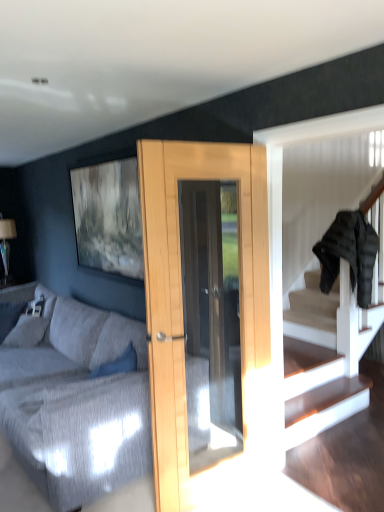
Question: Is black puffer jacket at upper right at the back of textured gray fabric couch at center?

Choices:
 (A) no
 (B) yes

Answer: (A)

Question: Does textured gray fabric couch at center have a greater height compared to black puffer jacket at upper right?

Choices:
 (A) yes
 (B) no

Answer: (B)

Question: Is textured gray fabric couch at center thinner than black puffer jacket at upper right?

Choices:
 (A) yes
 (B) no

Answer: (B)

Question: Is textured gray fabric couch at center positioned beyond the bounds of black puffer jacket at upper right?

Choices:
 (A) no
 (B) yes

Answer: (B)

Question: From a real-world perspective, is textured gray fabric couch at center below black puffer jacket at upper right?

Choices:
 (A) no
 (B) yes

Answer: (B)

Question: From the image's perspective, is textured gray fabric couch at center below black puffer jacket at upper right?

Choices:
 (A) no
 (B) yes

Answer: (B)

Question: Does black puffer jacket at upper right have a smaller size compared to textured gray fabric couch at center?

Choices:
 (A) yes
 (B) no

Answer: (A)

Question: Can you confirm if black puffer jacket at upper right is bigger than textured gray fabric couch at center?

Choices:
 (A) no
 (B) yes

Answer: (A)

Question: Can you confirm if black puffer jacket at upper right is taller than textured gray fabric couch at center?

Choices:
 (A) no
 (B) yes

Answer: (B)

Question: Can you confirm if black puffer jacket at upper right is shorter than textured gray fabric couch at center?

Choices:
 (A) yes
 (B) no

Answer: (B)

Question: Considering the relative positions of black puffer jacket at upper right and textured gray fabric couch at center in the image provided, is black puffer jacket at upper right behind textured gray fabric couch at center?

Choices:
 (A) yes
 (B) no

Answer: (A)

Question: Is black puffer jacket at upper right looking in the opposite direction of textured gray fabric couch at center?

Choices:
 (A) yes
 (B) no

Answer: (B)

Question: Considering the positions of textured gray fabric couch at center and black puffer jacket at upper right in the image, is textured gray fabric couch at center taller or shorter than black puffer jacket at upper right?

Choices:
 (A) tall
 (B) short

Answer: (B)